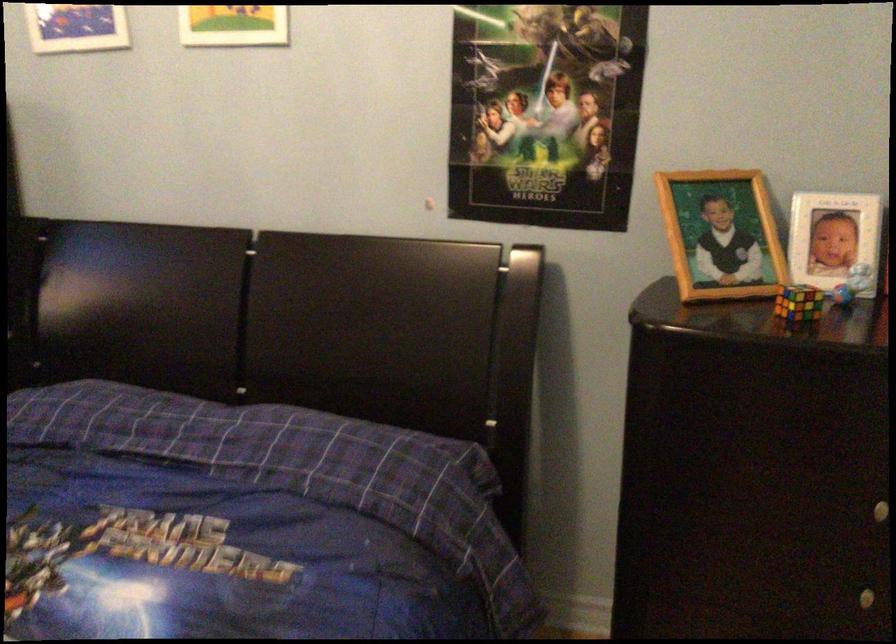
Find where to pull the silver drawer knob. Please return your answer as a coordinate pair (x, y).

(868, 597)